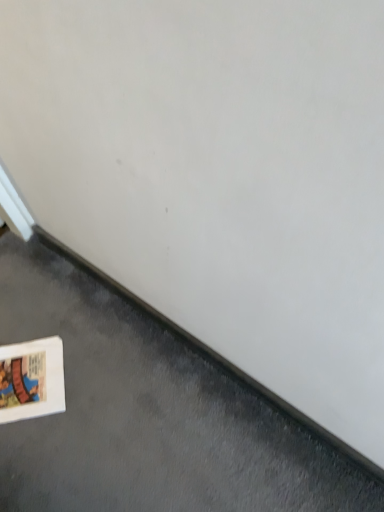
What do you see at coordinates (149, 413) in the screenshot? Image resolution: width=384 pixels, height=512 pixels. I see `white matte book at lower left` at bounding box center [149, 413].

In order to click on white matte book at lower left in this screenshot , I will do `click(149, 413)`.

Find the location of a particular element. white cardboard at lower left is located at coordinates (31, 379).

This screenshot has height=512, width=384. Describe the element at coordinates (31, 379) in the screenshot. I see `white cardboard at lower left` at that location.

This screenshot has height=512, width=384. I want to click on white matte book at lower left, so click(149, 413).

Is white matte book at lower left at the left side of white cardboard at lower left?

No, white matte book at lower left is not to the left of white cardboard at lower left.

Which object is further away from the camera taking this photo, white matte book at lower left or white cardboard at lower left?

white cardboard at lower left is behind.

Is point (76, 423) farther from viewer compared to point (2, 404)?

No, (76, 423) is closer to viewer.

From the image's perspective, which object appears higher, white matte book at lower left or white cardboard at lower left?

white cardboard at lower left, from the image's perspective.

From a real-world perspective, is white matte book at lower left beneath white cardboard at lower left?

No, from a real-world perspective, white matte book at lower left is not beneath white cardboard at lower left.

Between white matte book at lower left and white cardboard at lower left, which one has smaller width?

With smaller width is white cardboard at lower left.

Does white matte book at lower left have a greater height compared to white cardboard at lower left?

Yes.

Based on the photo, who is smaller, white matte book at lower left or white cardboard at lower left?

white cardboard at lower left.

Can we say white matte book at lower left lies outside white cardboard at lower left?

Absolutely, white matte book at lower left is external to white cardboard at lower left.

In the scene shown: Does white matte book at lower left touch white cardboard at lower left?

No.

Is white matte book at lower left oriented away from white cardboard at lower left?

No, white matte book at lower left is not facing away from white cardboard at lower left.

The width and height of the screenshot is (384, 512). What are the coordinates of `picture frame lying behind the white matte book at lower left` in the screenshot? It's located at (31, 379).

Considering the positions of objects white cardboard at lower left and white matte book at lower left in the image provided, who is more to the right, white cardboard at lower left or white matte book at lower left?

white matte book at lower left.

Is white cardboard at lower left in front of or behind white matte book at lower left in the image?

Clearly, white cardboard at lower left is behind white matte book at lower left.

Is point (13, 404) farther from camera compared to point (212, 473)?

Yes, it is.

From the image's perspective, is white cardboard at lower left beneath white matte book at lower left?

No.

From a real-world perspective, between white cardboard at lower left and white matte book at lower left, who is vertically lower?

white cardboard at lower left.

Considering the sizes of white cardboard at lower left and white matte book at lower left in the image, is white cardboard at lower left wider or thinner than white matte book at lower left?

In the image, white cardboard at lower left appears to be more narrow than white matte book at lower left.

Considering the relative sizes of white cardboard at lower left and white matte book at lower left in the image provided, is white cardboard at lower left shorter than white matte book at lower left?

Indeed, white cardboard at lower left has a lesser height compared to white matte book at lower left.

Does white cardboard at lower left have a smaller size compared to white matte book at lower left?

Correct, white cardboard at lower left occupies less space than white matte book at lower left.

Is white cardboard at lower left positioned beyond the bounds of white matte book at lower left?

Actually, white cardboard at lower left is within white matte book at lower left.

Is white cardboard at lower left far away from white matte book at lower left?

No, white cardboard at lower left is not far from white matte book at lower left.

Is white cardboard at lower left turned away from white matte book at lower left?

Yes, white matte book at lower left is at the back of white cardboard at lower left.

How different are the orientations of white cardboard at lower left and white matte book at lower left in degrees?

The angular difference between white cardboard at lower left and white matte book at lower left is 133 degrees.

At what (x,y) coordinates should I click in order to perform the action: click on picture frame behind the white matte book at lower left. Please return your answer as a coordinate pair (x, y). The width and height of the screenshot is (384, 512). Looking at the image, I should click on (31, 379).

At what (x,y) coordinates should I click in order to perform the action: click on concrete below the white cardboard at lower left (from the image's perspective). Please return your answer as a coordinate pair (x, y). This screenshot has width=384, height=512. Looking at the image, I should click on (149, 413).

Locate an element on the screen. concrete in front of the white cardboard at lower left is located at coordinates (149, 413).